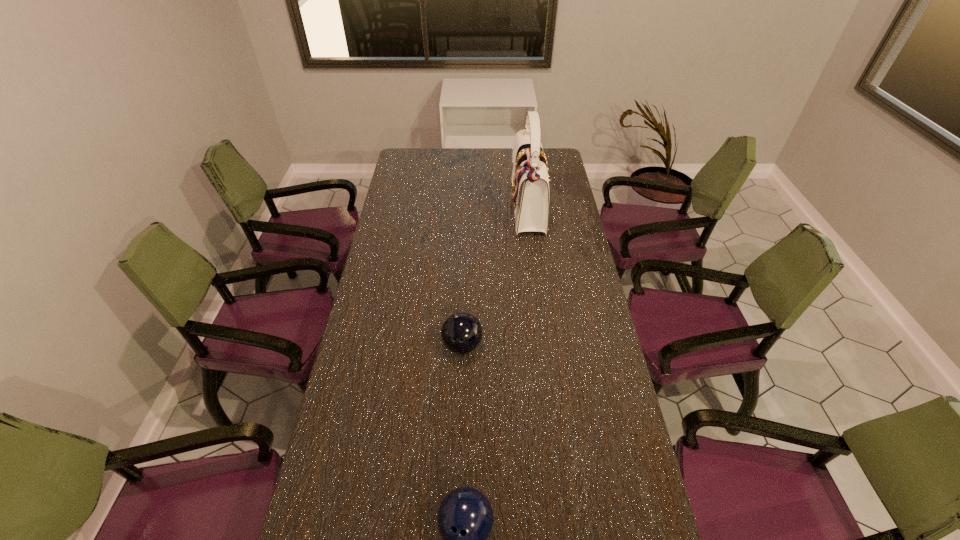
Locate an element on the screen. the rightmost object is located at coordinates (530, 185).

I want to click on satchel, so click(x=530, y=185).

The width and height of the screenshot is (960, 540). I want to click on the second farthest object, so click(461, 333).

The height and width of the screenshot is (540, 960). Identify the location of blank space located 0.170m on the front-facing side of the tallest object. (471, 210).

The width and height of the screenshot is (960, 540). In order to click on vacant space positioned on the front-facing side of the tallest object in this screenshot , I will do `click(468, 210)`.

At what (x,y) coordinates should I click in order to perform the action: click on free space located on the front-facing side of the tallest object. Please return your answer as a coordinate pair (x, y). The width and height of the screenshot is (960, 540). Looking at the image, I should click on (422, 210).

Find the location of a particular element. blank area located on the side of the second farthest object with the finger holes is located at coordinates (461, 385).

This screenshot has width=960, height=540. Identify the location of object that is at the right edge. (530, 185).

Locate an element on the screen. free space at the far edge of the desktop is located at coordinates (479, 156).

I want to click on free space at the left edge of the desktop, so click(x=381, y=324).